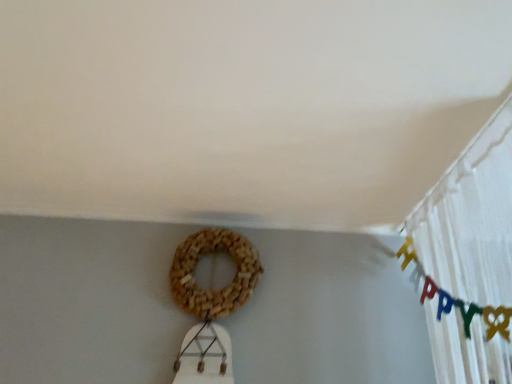
The height and width of the screenshot is (384, 512). In order to click on white sheer curtain at upper right in this screenshot , I will do `click(469, 258)`.

What do you see at coordinates (469, 258) in the screenshot?
I see `white sheer curtain at upper right` at bounding box center [469, 258].

What do you see at coordinates (210, 289) in the screenshot? I see `brown woven wreath at center` at bounding box center [210, 289].

In order to face brown woven wreath at center, should I rotate leftwards or rightwards?

Turn left approximately 5.369 degrees to face it.

Locate an element on the screen. brown woven wreath at center is located at coordinates (210, 289).

From the picture: What is the approximate height of brown woven wreath at center?

33.90 centimeters.

This screenshot has height=384, width=512. What are the coordinates of `white sheer curtain at upper right` in the screenshot? It's located at pos(469,258).

Is white sheer curtain at upper right to the left or to the right of brown woven wreath at center in the image?

Based on their positions, white sheer curtain at upper right is located to the right of brown woven wreath at center.

Which object is closer to the camera, white sheer curtain at upper right or brown woven wreath at center?

white sheer curtain at upper right.

Is point (447, 211) behind point (189, 246)?

No, it is in front of (189, 246).

From the image's perspective, which one is positioned lower, white sheer curtain at upper right or brown woven wreath at center?

brown woven wreath at center appears lower in the image.

From a real-world perspective, who is located lower, white sheer curtain at upper right or brown woven wreath at center?

white sheer curtain at upper right, from a real-world perspective.

Is white sheer curtain at upper right wider or thinner than brown woven wreath at center?

white sheer curtain at upper right is wider than brown woven wreath at center.

Considering the relative sizes of white sheer curtain at upper right and brown woven wreath at center in the image provided, is white sheer curtain at upper right taller than brown woven wreath at center?

Indeed, white sheer curtain at upper right has a greater height compared to brown woven wreath at center.

Does white sheer curtain at upper right have a smaller size compared to brown woven wreath at center?

No.

Which is correct: white sheer curtain at upper right is inside brown woven wreath at center, or outside of it?

white sheer curtain at upper right cannot be found inside brown woven wreath at center.

Is the surface of white sheer curtain at upper right in direct contact with brown woven wreath at center?

No, white sheer curtain at upper right is not beside brown woven wreath at center.

Is white sheer curtain at upper right oriented towards brown woven wreath at center?

No, white sheer curtain at upper right does not turn towards brown woven wreath at center.

Can you tell me how much white sheer curtain at upper right and brown woven wreath at center differ in facing direction?

The angle between the facing direction of white sheer curtain at upper right and the facing direction of brown woven wreath at center is 87.2 degrees.

Locate an element on the screen. The image size is (512, 384). curtain that is above the brown woven wreath at center (from the image's perspective) is located at coordinates (469, 258).

Considering the positions of objects brown woven wreath at center and white sheer curtain at upper right in the image provided, who is more to the right, brown woven wreath at center or white sheer curtain at upper right?

Positioned to the right is white sheer curtain at upper right.

Is brown woven wreath at center in front of or behind white sheer curtain at upper right in the image?

brown woven wreath at center is positioned farther from the viewer than white sheer curtain at upper right.

Which point is more forward, (177, 302) or (503, 236)?

The point (503, 236) is closer.

From the image's perspective, who appears lower, brown woven wreath at center or white sheer curtain at upper right?

brown woven wreath at center appears lower in the image.

From a real-world perspective, is brown woven wreath at center below white sheer curtain at upper right?

No, from a real-world perspective, brown woven wreath at center is not below white sheer curtain at upper right.

Is brown woven wreath at center wider or thinner than white sheer curtain at upper right?

In the image, brown woven wreath at center appears to be more narrow than white sheer curtain at upper right.

Considering the sizes of objects brown woven wreath at center and white sheer curtain at upper right in the image provided, who is shorter, brown woven wreath at center or white sheer curtain at upper right?

Standing shorter between the two is brown woven wreath at center.

Considering the sizes of objects brown woven wreath at center and white sheer curtain at upper right in the image provided, who is bigger, brown woven wreath at center or white sheer curtain at upper right?

white sheer curtain at upper right is bigger.

Is brown woven wreath at center located outside white sheer curtain at upper right?

Yes, brown woven wreath at center is located beyond the bounds of white sheer curtain at upper right.

Are brown woven wreath at center and white sheer curtain at upper right beside each other?

No, brown woven wreath at center is not next to white sheer curtain at upper right.

Is brown woven wreath at center positioned with its back to white sheer curtain at upper right?

No, brown woven wreath at center is not facing the opposite direction of white sheer curtain at upper right.

How far apart are brown woven wreath at center and white sheer curtain at upper right?

brown woven wreath at center and white sheer curtain at upper right are 30.36 inches apart from each other.

In the image, there is a brown woven wreath at center. What are the coordinates of `curtain above it (from the image's perspective)` in the screenshot? It's located at (469, 258).

Locate an element on the screen. The height and width of the screenshot is (384, 512). bagel behind the white sheer curtain at upper right is located at coordinates (210, 289).

In the image, there is a brown woven wreath at center. What are the coordinates of `curtain below it (from a real-world perspective)` in the screenshot? It's located at (469, 258).